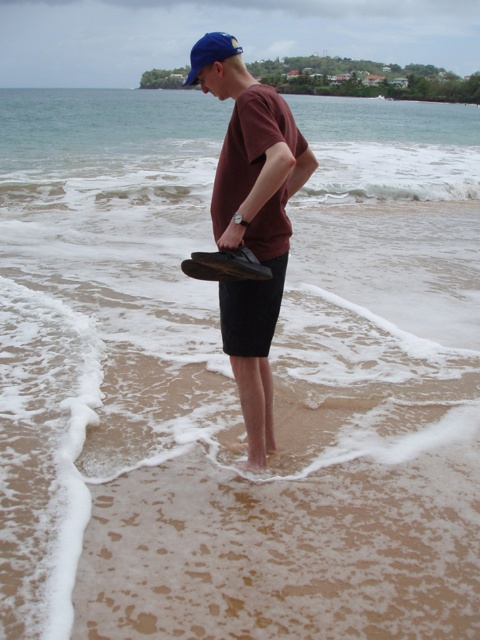
Question: Is matte black shoe at center positioned before blue fabric baseball cap at upper center?

Choices:
 (A) yes
 (B) no

Answer: (A)

Question: Does matte black shoe at center appear on the right side of blue fabric baseball cap at upper center?

Choices:
 (A) yes
 (B) no

Answer: (A)

Question: Where is matte black shoe at center located in relation to blue fabric baseball cap at upper center in the image?

Choices:
 (A) right
 (B) left

Answer: (A)

Question: Which object appears closest to the camera in this image?

Choices:
 (A) matte black shoe at center
 (B) blue fabric baseball cap at upper center

Answer: (A)